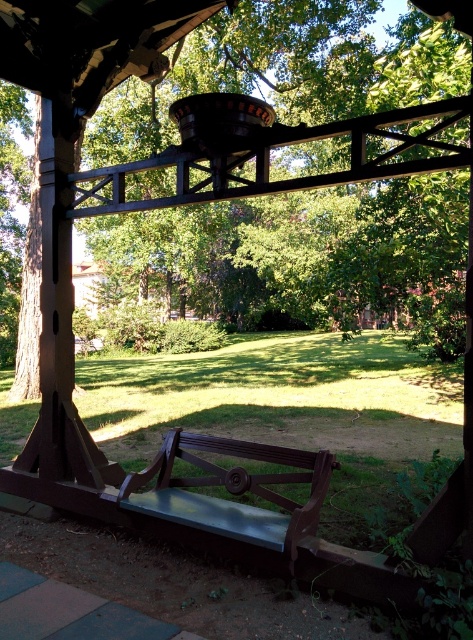
Measure the distance between brown wood tree at upper left and metallic polished bench at center.

7.95 feet

Does point (458, 13) lie in front of point (202, 438)?

Yes, it is in front of point (202, 438).

The height and width of the screenshot is (640, 473). In order to click on brown wood tree at upper left in this screenshot , I will do `click(90, 38)`.